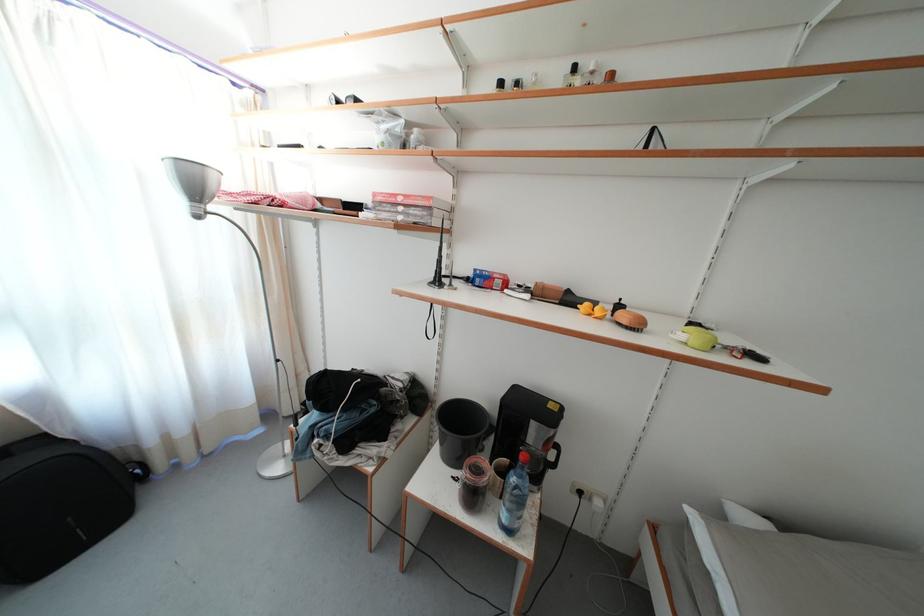
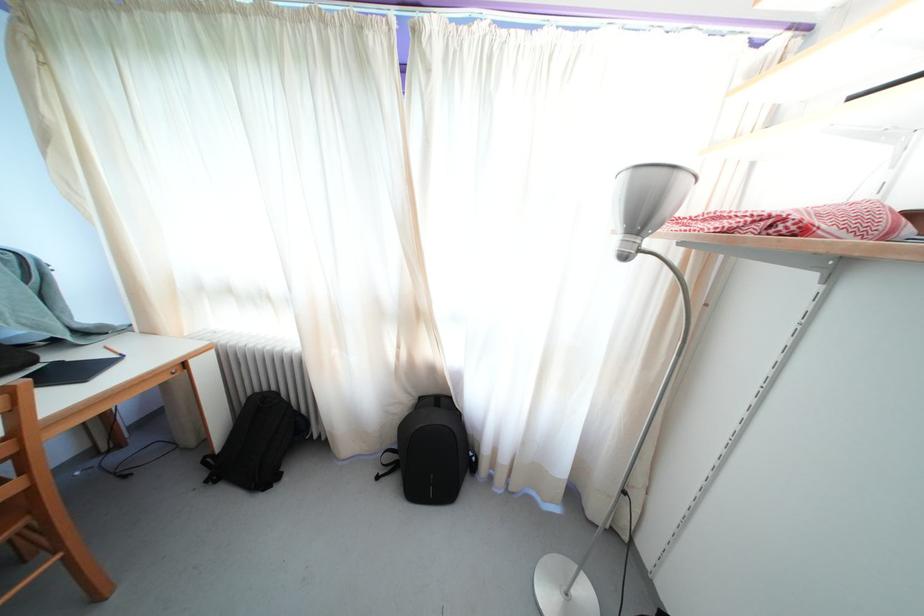
Question: How did the camera likely rotate?

Choices:
 (A) Left
 (B) Right
 (C) Up
 (D) Down

Answer: (A)